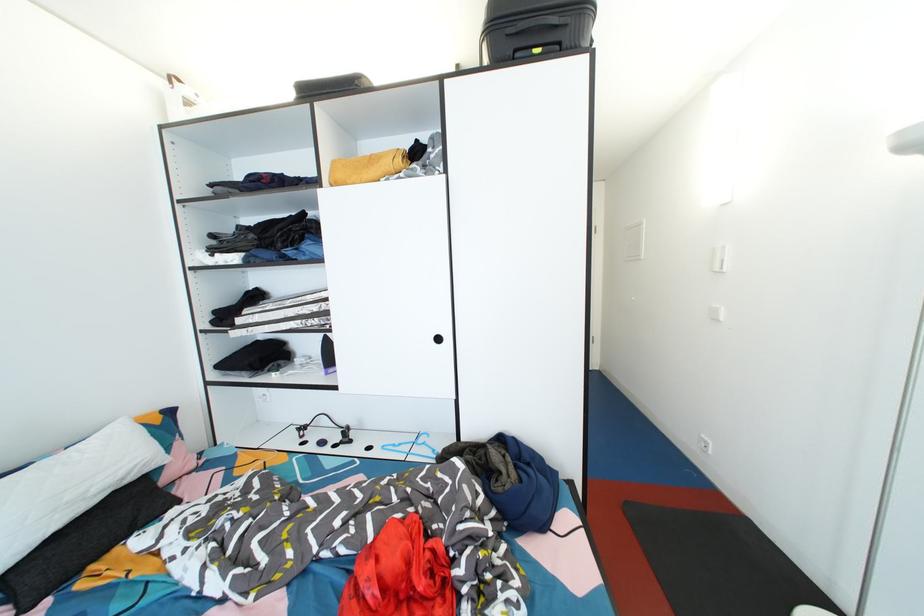
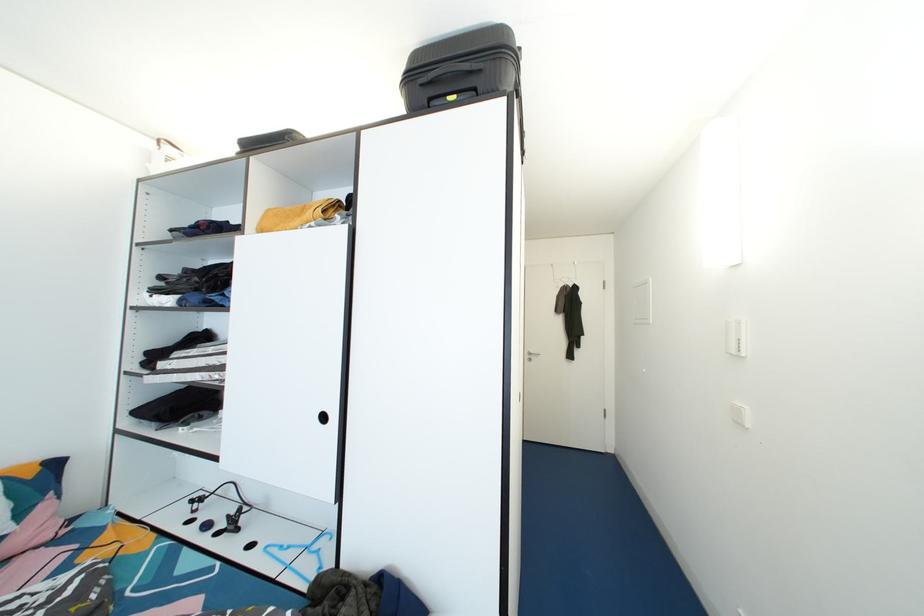
Question: The first image is from the beginning of the video and the second image is from the end. How did the camera likely rotate when shooting the video?

Choices:
 (A) Left
 (B) Right
 (C) Up
 (D) Down

Answer: (C)